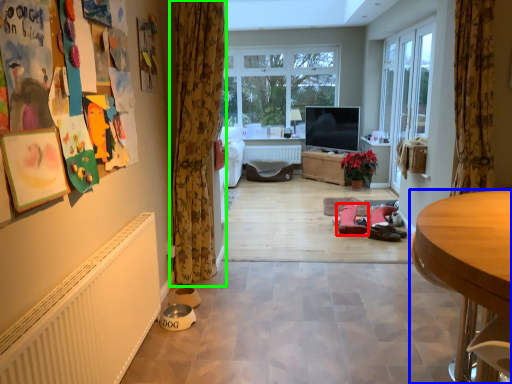
Question: Which object is the closest to the footwear (highlighted by a red box)? Choose among these: desk (highlighted by a blue box) or curtain (highlighted by a green box).

Choices:
 (A) desk
 (B) curtain

Answer: (B)